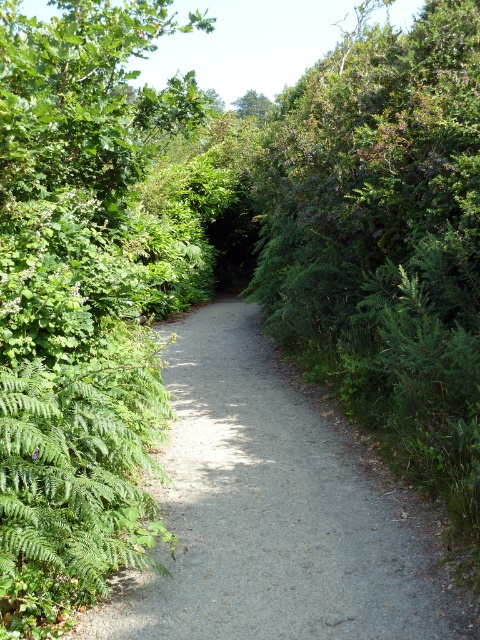
Question: Among these objects, which one is nearest to the camera?

Choices:
 (A) green leafy tree at upper center
 (B) gray gravel path at center

Answer: (B)

Question: Among these points, which one is farthest from the camera?

Choices:
 (A) (223, 557)
 (B) (241, 96)

Answer: (B)

Question: From the image, what is the correct spatial relationship of gray gravel path at center in relation to green leafy tree at upper center?

Choices:
 (A) below
 (B) above

Answer: (A)

Question: Can you confirm if gray gravel path at center is bigger than green leafy tree at upper center?

Choices:
 (A) yes
 (B) no

Answer: (B)

Question: In this image, where is gray gravel path at center located relative to green leafy tree at upper center?

Choices:
 (A) left
 (B) right

Answer: (A)

Question: Which point is farther to the camera?

Choices:
 (A) (317, 634)
 (B) (252, 109)

Answer: (B)